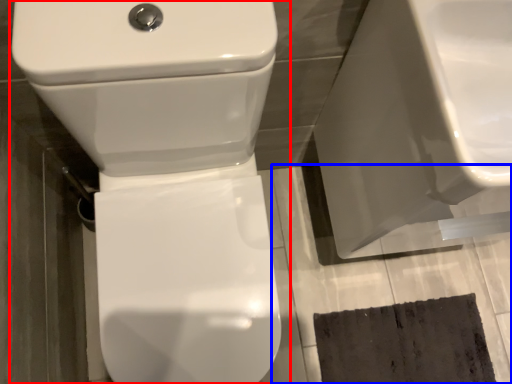
Question: Which of the following is the farthest to the observer, toilet (highlighted by a red box) or concrete (highlighted by a blue box)?

Choices:
 (A) toilet
 (B) concrete

Answer: (B)